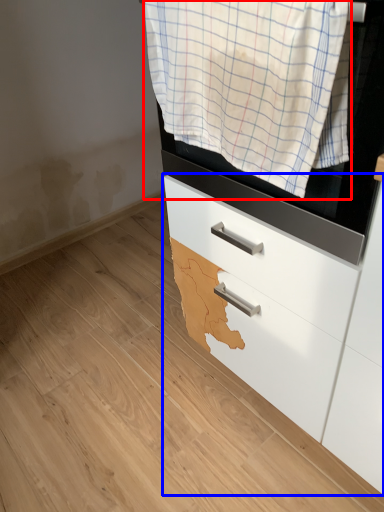
Question: Which object is further to the camera taking this photo, clothing (highlighted by a red box) or chest of drawers (highlighted by a blue box)?

Choices:
 (A) clothing
 (B) chest of drawers

Answer: (B)